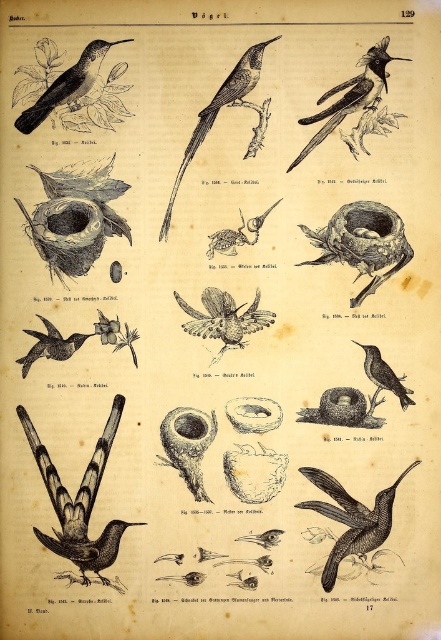
Between black glossy hummingbird at lower left and smooth black hummingbird at lower left, which one appears on the right side from the viewer's perspective?

From the viewer's perspective, black glossy hummingbird at lower left appears more on the right side.

Does black glossy hummingbird at lower left have a larger size compared to smooth black hummingbird at lower left?

Indeed, black glossy hummingbird at lower left has a larger size compared to smooth black hummingbird at lower left.

This screenshot has height=640, width=441. I want to click on black glossy hummingbird at lower left, so click(x=78, y=500).

Is smooth black bird at center smaller than smooth black hummingbird at lower left?

Incorrect, smooth black bird at center is not smaller in size than smooth black hummingbird at lower left.

Between point (213, 113) and point (26, 355), which one is positioned in front?

Point (213, 113) is in front.

The image size is (441, 640). In order to click on smooth black bird at center in this screenshot , I will do `click(217, 112)`.

Locate an element on the screen. smooth black bird at center is located at coordinates (217, 112).

Who is positioned more to the left, black glossy hummingbird at upper right or smooth black bird at center?

smooth black bird at center

Measure the distance between black glossy hummingbird at upper right and smooth black bird at center.

black glossy hummingbird at upper right and smooth black bird at center are 6.40 inches apart from each other.

Locate an element on the screen. black glossy hummingbird at upper right is located at coordinates (351, 96).